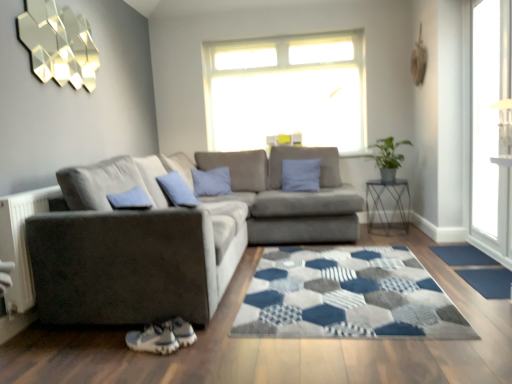
Question: Considering the relative positions of green leafy plant at right and metallic wire table at right in the image provided, is green leafy plant at right in front of metallic wire table at right?

Choices:
 (A) no
 (B) yes

Answer: (B)

Question: Is green leafy plant at right not inside metallic wire table at right?

Choices:
 (A) yes
 (B) no

Answer: (A)

Question: Does green leafy plant at right have a lesser height compared to metallic wire table at right?

Choices:
 (A) yes
 (B) no

Answer: (A)

Question: Does green leafy plant at right have a lesser width compared to metallic wire table at right?

Choices:
 (A) yes
 (B) no

Answer: (A)

Question: Is green leafy plant at right further to camera compared to metallic wire table at right?

Choices:
 (A) yes
 (B) no

Answer: (B)

Question: Could metallic wire table at right be considered to be inside green leafy plant at right?

Choices:
 (A) no
 (B) yes

Answer: (A)

Question: Is blue fabric doormat at lower right, which is counted as the second doormat, starting from the back, not inside green leafy plant at right?

Choices:
 (A) no
 (B) yes

Answer: (B)

Question: Is the position of blue fabric doormat at lower right, which is counted as the second doormat, starting from the back, more distant than that of green leafy plant at right?

Choices:
 (A) no
 (B) yes

Answer: (A)

Question: Can you confirm if blue fabric doormat at lower right, which is counted as the second doormat, starting from the back, is smaller than green leafy plant at right?

Choices:
 (A) yes
 (B) no

Answer: (A)

Question: Is blue fabric doormat at lower right, placed as the 1th doormat when sorted from front to back, beside green leafy plant at right?

Choices:
 (A) no
 (B) yes

Answer: (A)

Question: Considering the relative sizes of blue fabric doormat at lower right, which is counted as the second doormat, starting from the back, and green leafy plant at right in the image provided, is blue fabric doormat at lower right, which is counted as the second doormat, starting from the back, bigger than green leafy plant at right?

Choices:
 (A) no
 (B) yes

Answer: (A)

Question: Does blue fabric doormat at lower right, which is counted as the second doormat, starting from the back, appear on the right side of green leafy plant at right?

Choices:
 (A) no
 (B) yes

Answer: (B)

Question: Can you confirm if blue fabric doormat at lower right, which is counted as the second doormat, starting from the back, is smaller than transparent glass door at right?

Choices:
 (A) no
 (B) yes

Answer: (B)